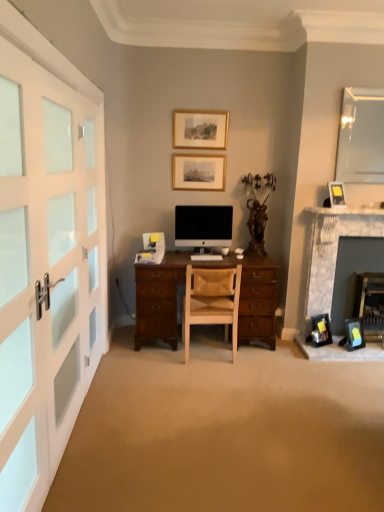
Question: From a real-world perspective, is gold-framed picture at upper center, which is the 4th picture frame from right to left, located beneath matte black picture frame at lower right, which is counted as the first picture frame, starting from the right?

Choices:
 (A) yes
 (B) no

Answer: (B)

Question: From the image's perspective, is gold-framed picture at upper center, which ranks as the 2th picture frame in left-to-right order, above matte black picture frame at lower right, the 5th picture frame viewed from the left?

Choices:
 (A) yes
 (B) no

Answer: (A)

Question: Is gold-framed picture at upper center, which is the 4th picture frame from right to left, positioned behind matte black picture frame at lower right, which is counted as the first picture frame, starting from the right?

Choices:
 (A) yes
 (B) no

Answer: (A)

Question: Considering the relative sizes of gold-framed picture at upper center, which is the 4th picture frame from right to left, and matte black picture frame at lower right, which is counted as the first picture frame, starting from the right, in the image provided, is gold-framed picture at upper center, which is the 4th picture frame from right to left, shorter than matte black picture frame at lower right, which is counted as the first picture frame, starting from the right,?

Choices:
 (A) no
 (B) yes

Answer: (A)

Question: Does gold-framed picture at upper center, which is counted as the first picture frame, starting from the top, have a smaller size compared to matte black picture frame at lower right, arranged as the 5th picture frame when viewed from the top?

Choices:
 (A) no
 (B) yes

Answer: (A)

Question: Does gold-framed picture at upper center, which is the 4th picture frame from right to left, have a lesser width compared to matte black picture frame at lower right, the 5th picture frame viewed from the left?

Choices:
 (A) no
 (B) yes

Answer: (B)

Question: Is satin black monitor at center looking in the opposite direction of matte black picture frame at lower right, which appears as the 2th picture frame when ordered from the bottom?

Choices:
 (A) no
 (B) yes

Answer: (A)

Question: Would you say matte black picture frame at lower right, which is the fourth picture frame from top to bottom, is part of satin black monitor at center's contents?

Choices:
 (A) no
 (B) yes

Answer: (A)

Question: From the image's perspective, is satin black monitor at center located above matte black picture frame at lower right, the 3th picture frame positioned from the right?

Choices:
 (A) yes
 (B) no

Answer: (A)

Question: Is satin black monitor at center next to matte black picture frame at lower right, the third picture frame viewed from the left?

Choices:
 (A) no
 (B) yes

Answer: (A)

Question: Does satin black monitor at center have a lesser height compared to matte black picture frame at lower right, which is the fourth picture frame from top to bottom?

Choices:
 (A) no
 (B) yes

Answer: (A)

Question: Are satin black monitor at center and matte black picture frame at lower right, the third picture frame viewed from the left, far apart?

Choices:
 (A) no
 (B) yes

Answer: (B)

Question: Is matte black picture frame at lower right, which is counted as the first picture frame, starting from the right, taller than leather at center?

Choices:
 (A) no
 (B) yes

Answer: (A)